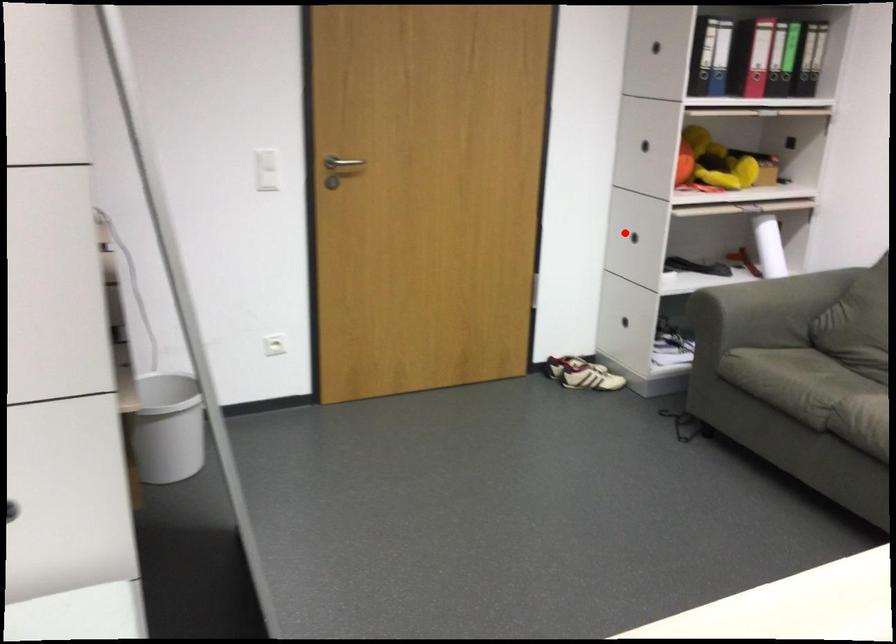
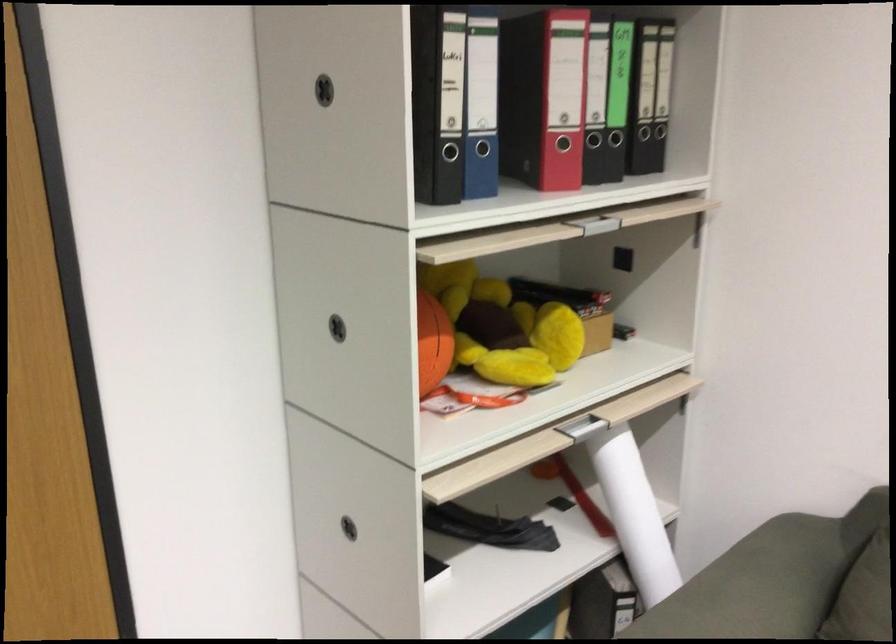
Question: A red point is marked in image1. In image2, is the corresponding 3D point closer to the camera or farther? Reply with the corresponding letter.

Choices:
 (A) The corresponding 3D point is closer.
 (B) The corresponding 3D point is farther.

Answer: (A)